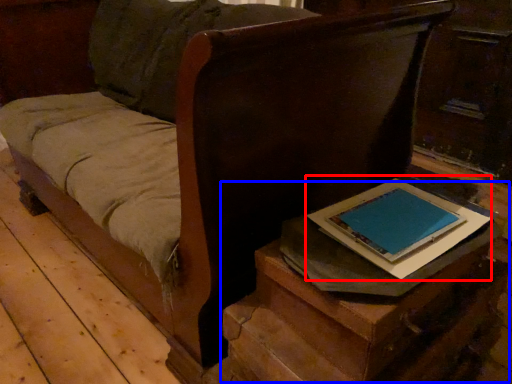
Question: Which point is further to the camera, paperback book (highlighted by a red box) or table (highlighted by a blue box)?

Choices:
 (A) paperback book
 (B) table

Answer: (A)